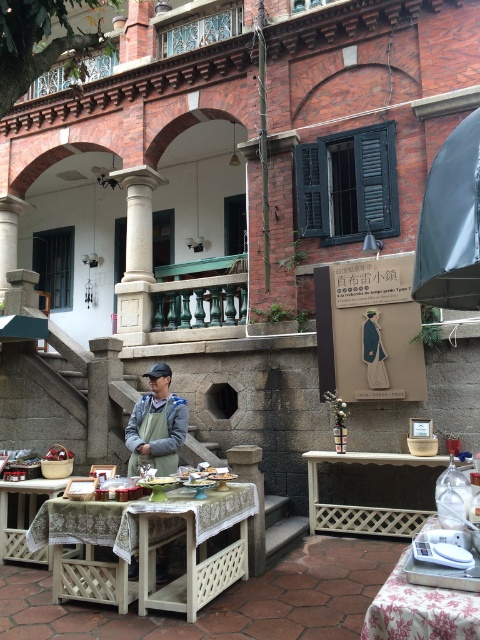
You are standing at the entrance of the red brick building and want to locate the floral fabric table at lower right. According to the coordinates provided, where exactly should you look?

The floral fabric table at lower right is located at point (423, 605).

You are a customer looking to place an order at the wooden lattice table at center. The server is wearing a gray fabric apron at center. Can you tell me which item is smaller in size?

The gray fabric apron at center has a smaller size compared to the wooden lattice table at center.